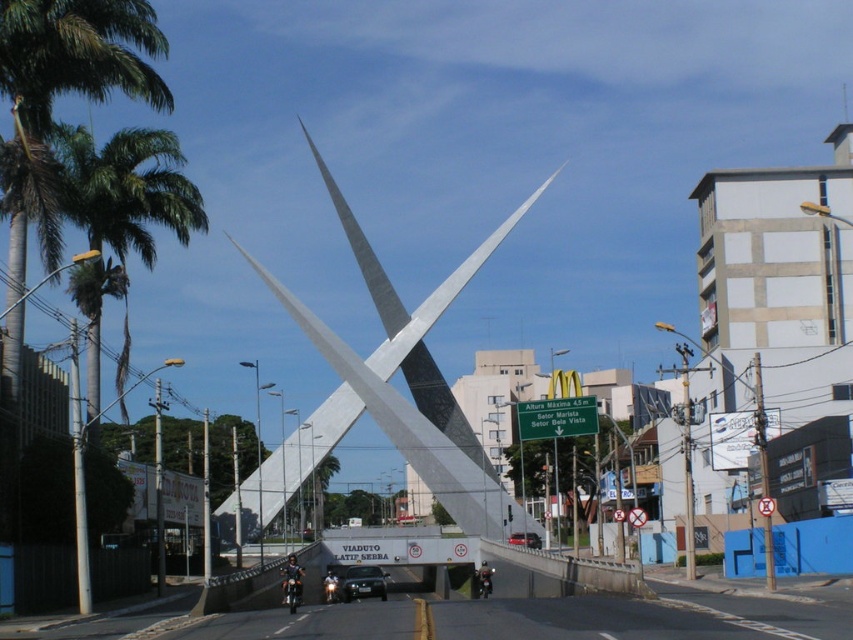
Question: Which of the following is the closest to the observer?

Choices:
 (A) metallic silver car at center
 (B) black metallic car at center

Answer: (B)

Question: Which object is positioned closest to the silver polished steel sculpture at center?

Choices:
 (A) metallic silver car at center
 (B) black metallic car at center

Answer: (A)

Question: Does black metallic car at center appear under metallic silver car at center?

Choices:
 (A) no
 (B) yes

Answer: (B)

Question: Is silver polished steel sculpture at center to the left of black metallic car at center from the viewer's perspective?

Choices:
 (A) yes
 (B) no

Answer: (A)

Question: Which object is farther from the camera taking this photo?

Choices:
 (A) silver polished steel sculpture at center
 (B) metallic silver car at center
 (C) black metallic car at center

Answer: (A)

Question: Does black metallic car at center have a larger size compared to metallic silver car at center?

Choices:
 (A) no
 (B) yes

Answer: (B)